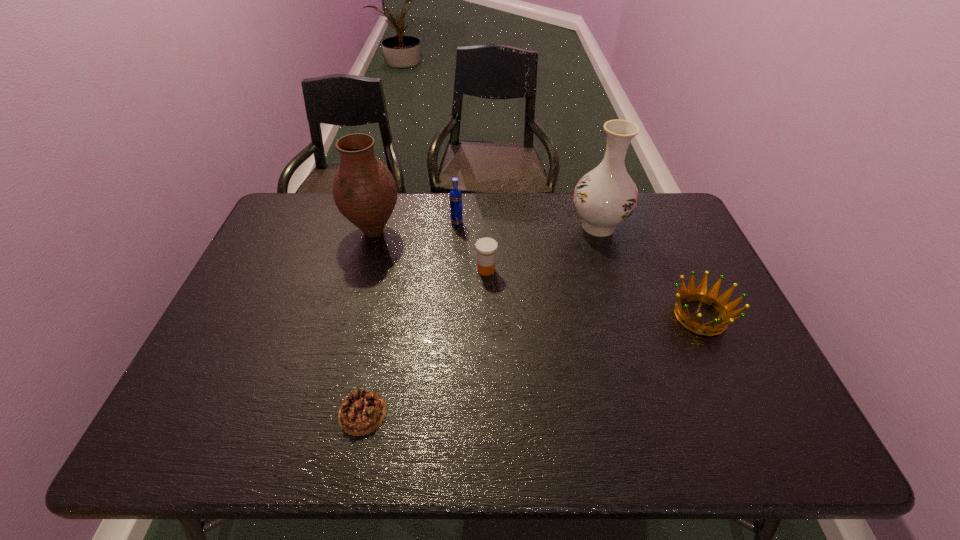
Image resolution: width=960 pixels, height=540 pixels. Identify the location of the second object from right to left. (606, 196).

Where is `the left vase`? the left vase is located at coordinates (364, 190).

Locate an element on the screen. the fourth shortest object is located at coordinates pos(456,212).

Identify the location of the fourth object from right to left. (456, 212).

The image size is (960, 540). Identify the location of the third nearest object. (486, 248).

At what (x,y) coordinates should I click in order to perform the action: click on the fourth object from left to right. Please return your answer as a coordinate pair (x, y). The image size is (960, 540). Looking at the image, I should click on (486, 248).

Where is `the fifth farthest object`? the fifth farthest object is located at coordinates (710, 297).

Where is `crown`? This screenshot has height=540, width=960. crown is located at coordinates (710, 297).

You are a GUI agent. You are given a task and a screenshot of the screen. Output one action in this format:
    pyautogui.click(x=<x>, y=<y>)
    Task: Click on the chocolate cake
    This screenshot has width=960, height=540.
    Given the screenshot: What is the action you would take?
    pyautogui.click(x=362, y=411)

The width and height of the screenshot is (960, 540). Find the location of `the nearest object`. the nearest object is located at coordinates (362, 411).